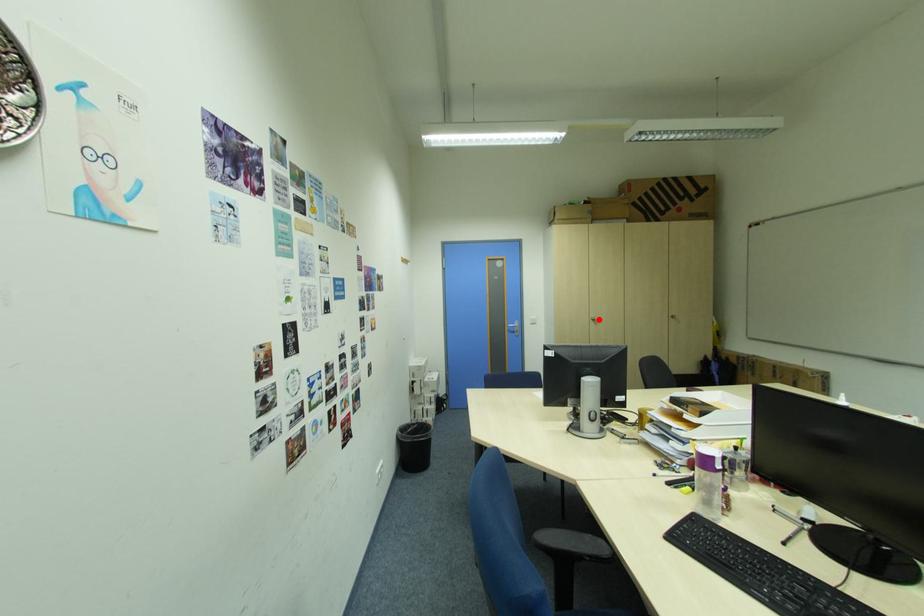
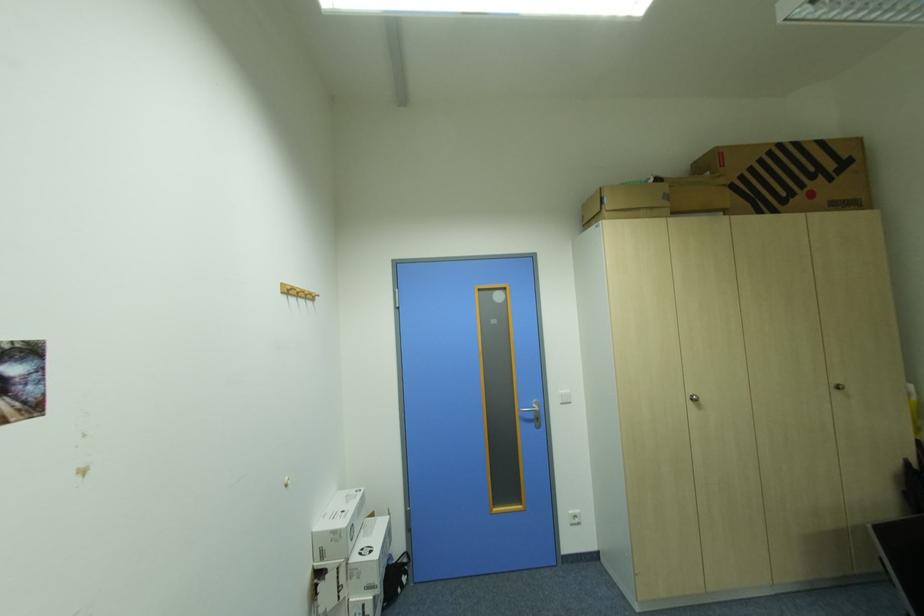
Where in the second image is the point corresponding to the highlighted location from the first image?

(697, 399)